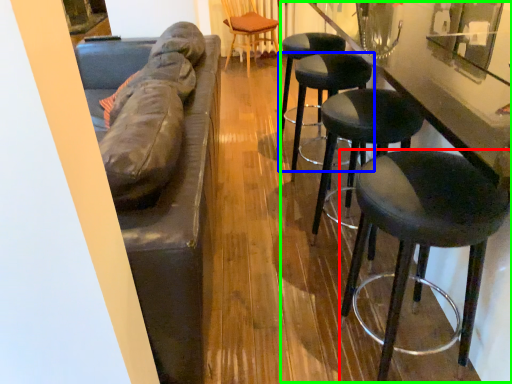
Question: Estimate the real-world distances between objects in this image. Which object is farther from stool (highlighted by a red box), stool (highlighted by a blue box) or counter (highlighted by a green box)?

Choices:
 (A) stool
 (B) counter

Answer: (A)